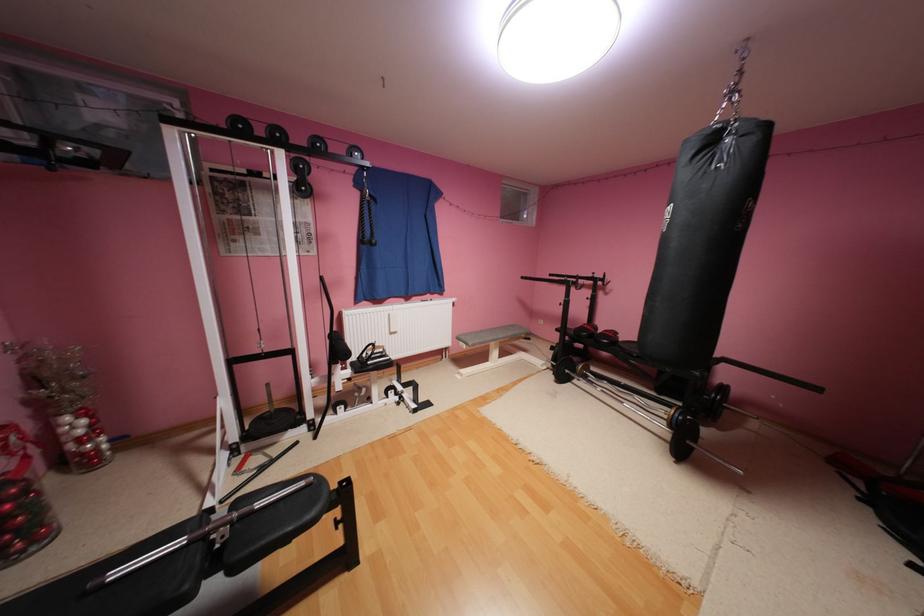
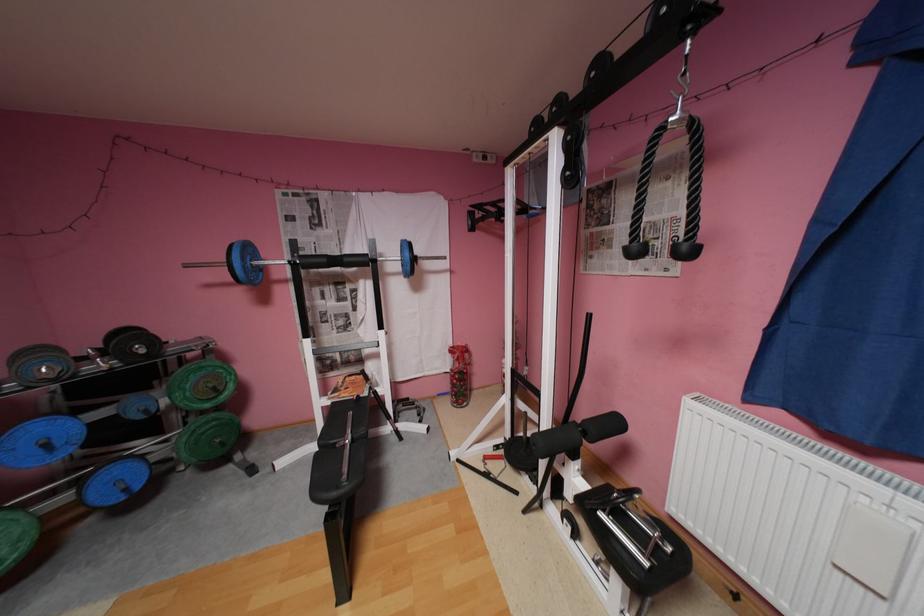
Where in the second image is the point corresponding to point 383,241 from the first image?

(695, 246)